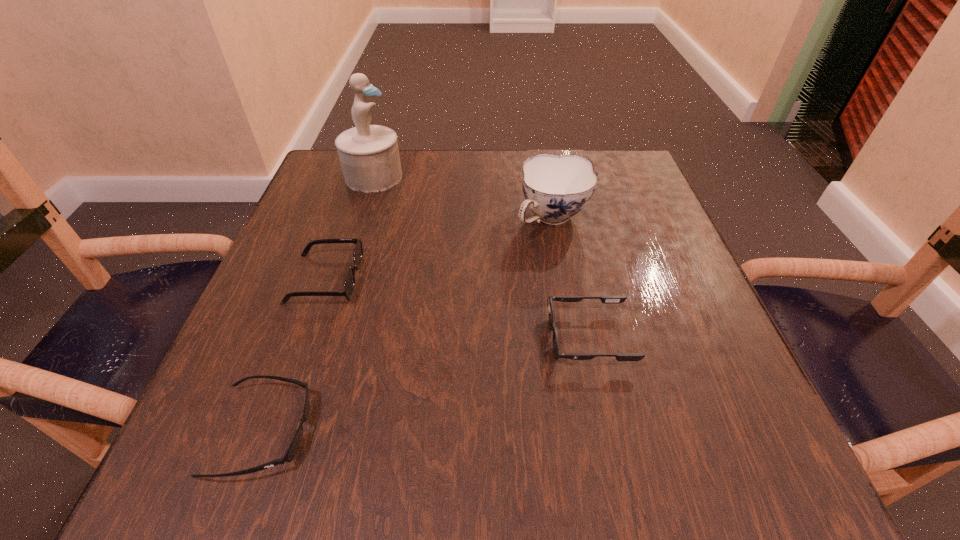
At what (x,y) coordinates should I click in order to perform the action: click on vacant area situated 0.300m on the left of the fourth nearest object. Please return your answer as a coordinate pair (x, y). Looking at the image, I should click on (371, 219).

The width and height of the screenshot is (960, 540). Identify the location of free spot located 0.190m on the front-facing side of the third farthest object. (465, 279).

This screenshot has width=960, height=540. What are the coordinates of `free space located 0.160m on the temples of the rightmost sunglasses` in the screenshot? It's located at (448, 338).

Where is `free space located 0.310m on the temples of the rightmost sunglasses`? This screenshot has height=540, width=960. free space located 0.310m on the temples of the rightmost sunglasses is located at coordinates (355, 338).

At what (x,y) coordinates should I click in order to perform the action: click on free spot located 0.250m on the temples of the rightmost sunglasses. Please return your answer as a coordinate pair (x, y). Looking at the image, I should click on (393, 338).

Where is `vacant area located on the front-facing side of the nearest sunglasses`? This screenshot has width=960, height=540. vacant area located on the front-facing side of the nearest sunglasses is located at coordinates (502, 431).

Where is `figurine at the far edge`? Image resolution: width=960 pixels, height=540 pixels. figurine at the far edge is located at coordinates (369, 155).

You are a GUI agent. You are given a task and a screenshot of the screen. Output one action in this format:
    pyautogui.click(x=<x>, y=<y>)
    Task: Click on the chinaware present at the far edge
    This screenshot has width=960, height=540.
    Given the screenshot: What is the action you would take?
    pyautogui.click(x=556, y=187)

The image size is (960, 540). In order to click on object positioned at the near edge in this screenshot , I will do `click(291, 452)`.

Where is `figurine that is at the left edge`? figurine that is at the left edge is located at coordinates (369, 155).